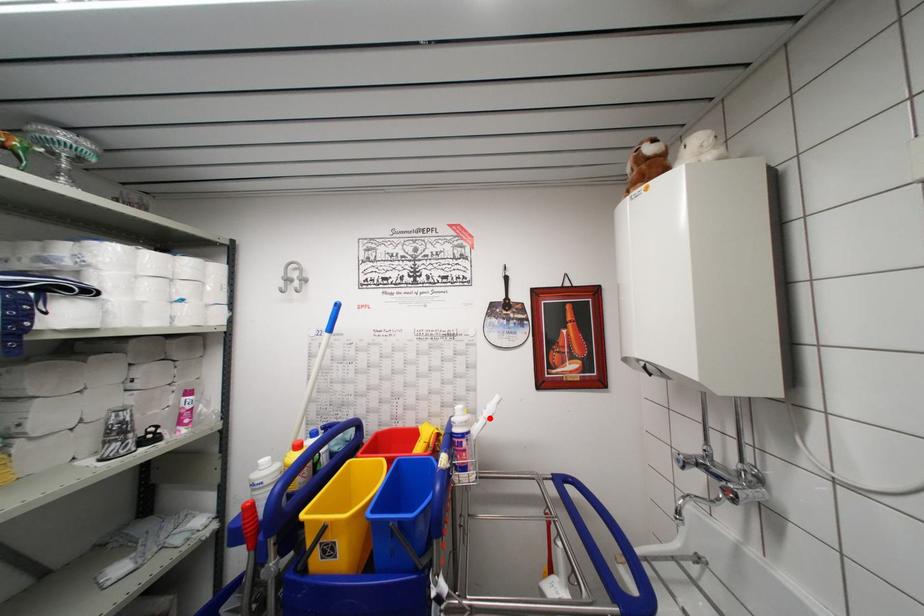
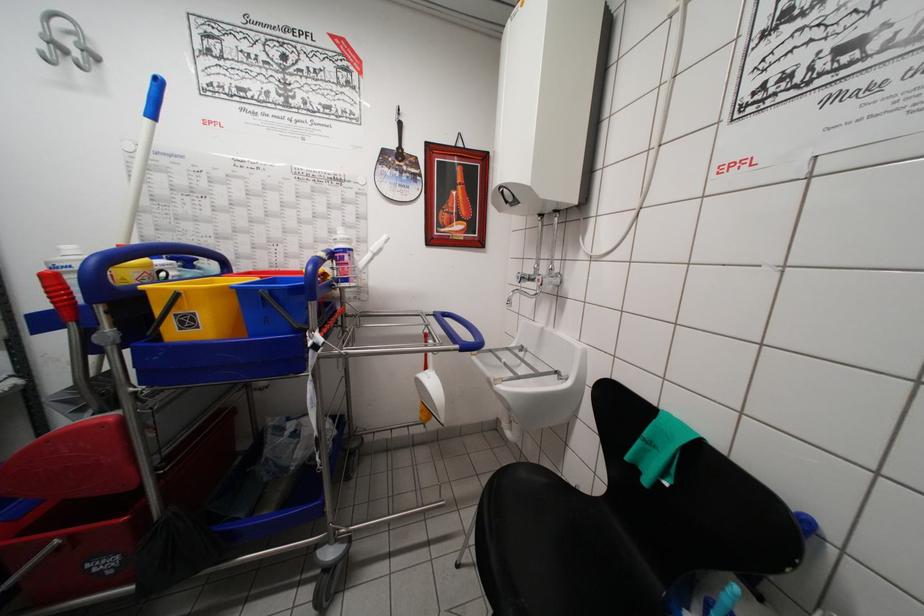
Where in the second image is the point corresponding to the highlighted location from the first image?

(377, 253)